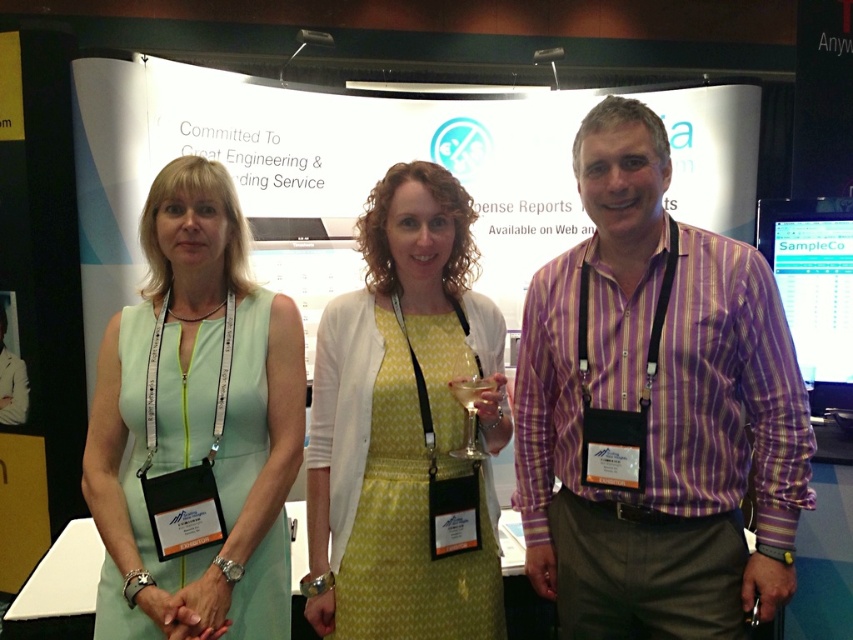
You are standing in front of the backdrop at the professional event. You need to locate the purple striped shirt at center. Where exactly is it positioned in terms of coordinates?

The purple striped shirt at center is positioned at the 2D coordinates point [656,410].

You are at a conference and see the purple striped shirt at center and the clear plastic wine glass at center. Which object is wider?

The purple striped shirt at center is wider than the clear plastic wine glass at center.

You are at a conference and need to hand a document to the person wearing the light green fabric dress at left. Since you are standing in front of the clear plastic wine glass at center, which direction should you move to reach them?

The light green fabric dress at left is positioned on the left side of the clear plastic wine glass at center, so you should move to your left to reach the person wearing the light green fabric dress at left.